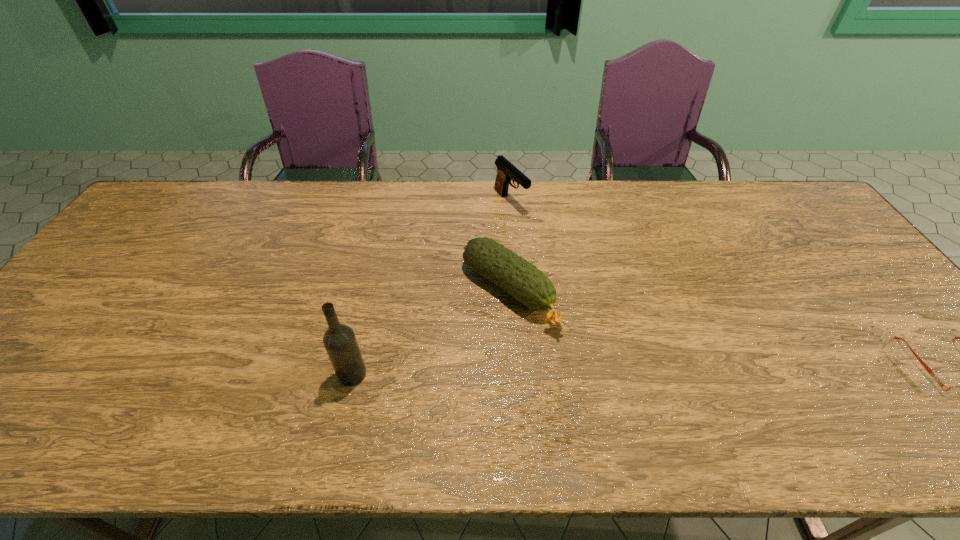
At what (x,y) coordinates should I click in order to perform the action: click on vacant area located at the blossom end of the cucumber. Please return your answer as a coordinate pair (x, y). Image resolution: width=960 pixels, height=540 pixels. Looking at the image, I should click on click(x=593, y=363).

At what (x,y) coordinates should I click in order to perform the action: click on free region located 0.270m at the blossom end of the cucumber. Please return your answer as a coordinate pair (x, y). Looking at the image, I should click on (636, 397).

Where is `object that is at the far edge`? This screenshot has width=960, height=540. object that is at the far edge is located at coordinates (506, 171).

At what (x,y) coordinates should I click in order to perform the action: click on object present at the near edge. Please return your answer as a coordinate pair (x, y). The height and width of the screenshot is (540, 960). Looking at the image, I should click on (339, 340).

Where is `vacant space at the far edge of the desktop`? The width and height of the screenshot is (960, 540). vacant space at the far edge of the desktop is located at coordinates (342, 223).

I want to click on blank area at the near edge, so click(710, 376).

Locate an element on the screen. The image size is (960, 540). vacant area at the right edge is located at coordinates (811, 240).

What are the coordinates of `free space at the far left corner of the desktop` in the screenshot? It's located at (173, 203).

Find the location of a particular element. vacant position at the far right corner of the desktop is located at coordinates (798, 211).

Find the location of a particular element. This screenshot has width=960, height=540. vacant space in between the third shortest object and the leftmost object is located at coordinates (431, 288).